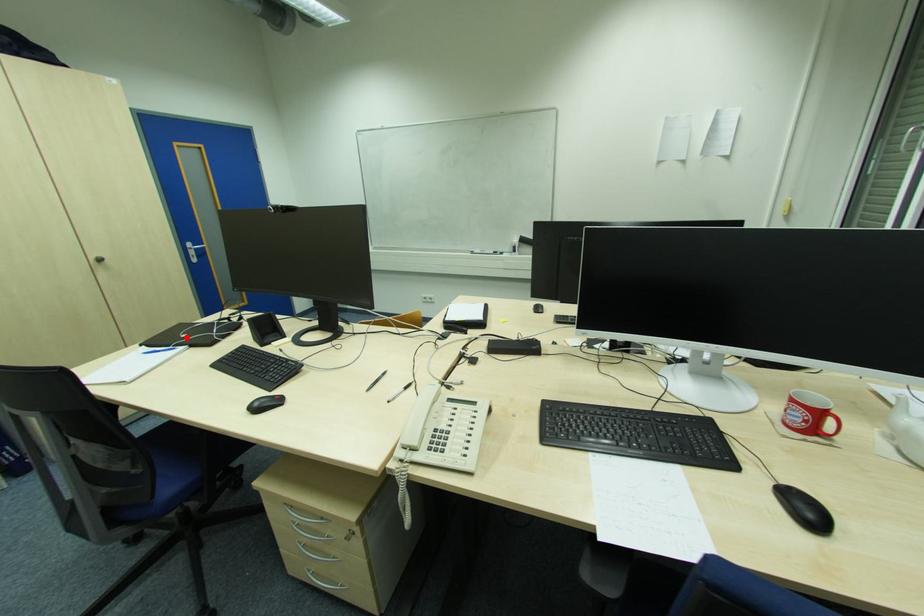
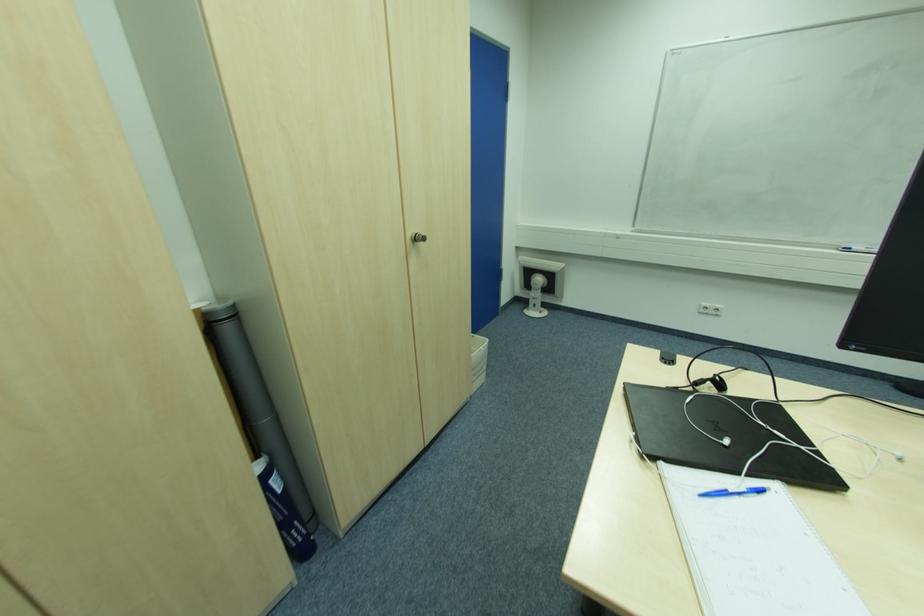
Locate, in the second image, the point that corresponds to the highlighted location in the first image.

(728, 443)